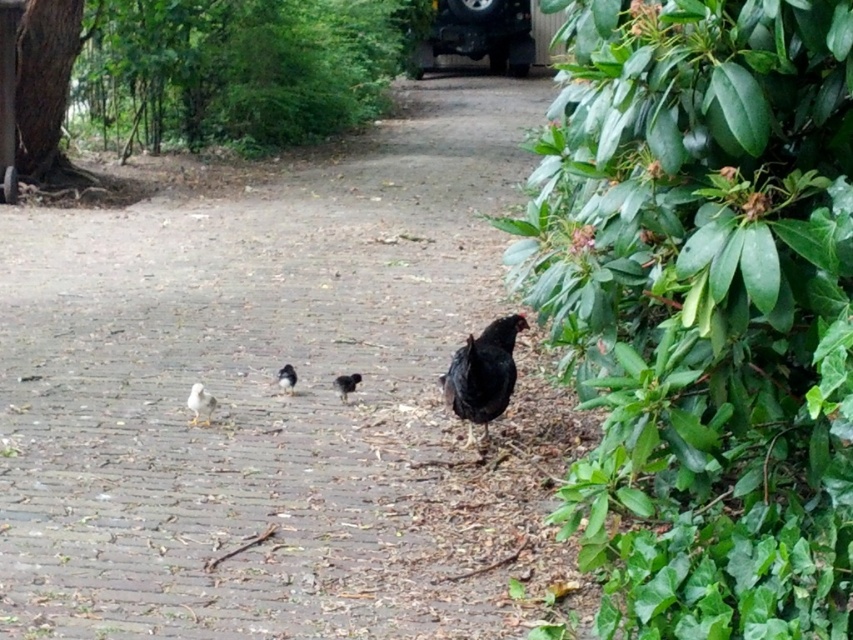
Based on the photo, you are standing on the paved pathway and want to take a photo of both the green leafy bush at right and the black matte chicken at right. Which object should you focus on first to ensure both are in clear view?

The green leafy bush at right is closer to the viewer than the black matte chicken at right, so focus on the green leafy bush at right first to ensure both are in clear focus.

You are a delivery drone flying above the brick pavement at center and the white fluffy chicken at lower left. Which object is higher from the ground?

The brick pavement at center is higher from the ground compared to the white fluffy chicken at lower left.